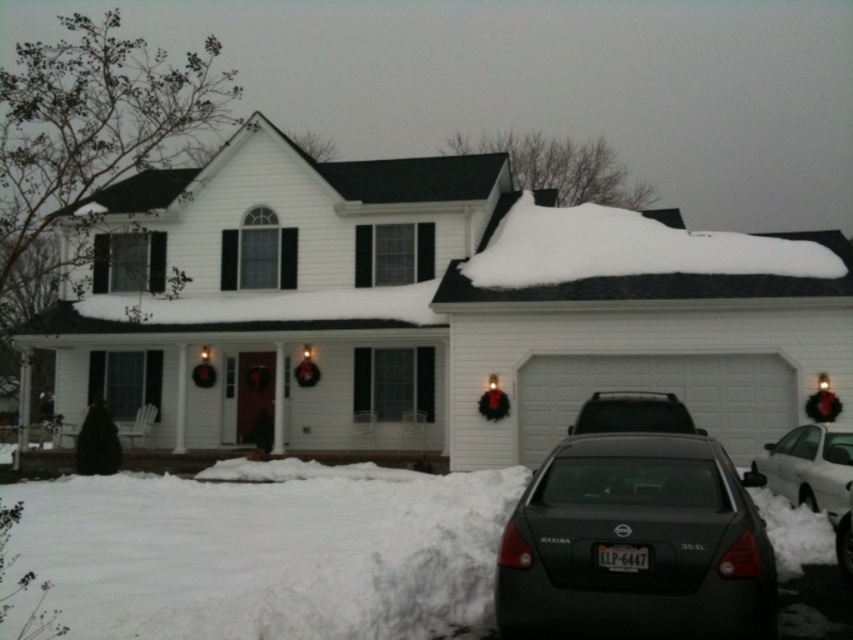
Question: Is matte black sedan at lower right smaller than dark gray metallic sedan at lower center?

Choices:
 (A) no
 (B) yes

Answer: (A)

Question: Can you confirm if matte black suv at center is positioned above dark gray metallic sedan at lower center?

Choices:
 (A) yes
 (B) no

Answer: (A)

Question: Considering the real-world distances, which object is closest to the matte black sedan at lower right?

Choices:
 (A) white fluffy snow at upper right
 (B) matte black suv at center
 (C) dark gray metallic sedan at lower center

Answer: (C)

Question: Can you confirm if matte black sedan at lower right is positioned below dark gray metallic sedan at lower center?

Choices:
 (A) yes
 (B) no

Answer: (B)

Question: Which of the following is the closest to the observer?

Choices:
 (A) (813, 499)
 (B) (743, 241)
 (C) (849, 502)

Answer: (C)

Question: Which of the following is the farthest from the observer?

Choices:
 (A) [643, 232]
 (B) [543, 600]
 (C) [587, 413]
 (D) [798, 464]

Answer: (A)